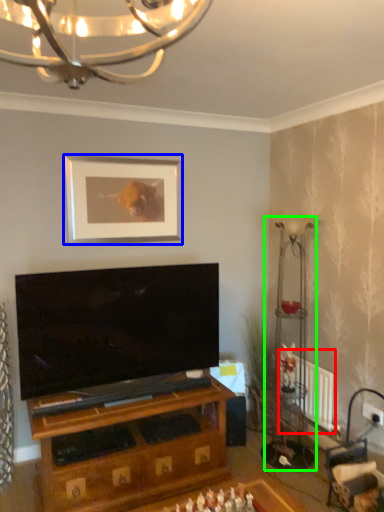
Question: Considering the real-world distances, which object is farthest from radiator (highlighted by a red box)? picture frame (highlighted by a blue box) or lamp (highlighted by a green box)?

Choices:
 (A) picture frame
 (B) lamp

Answer: (A)